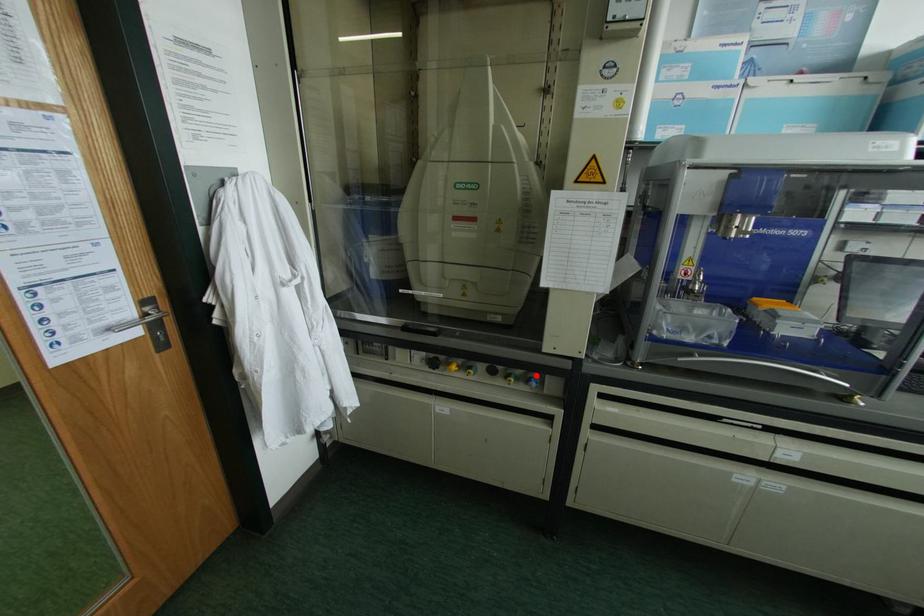
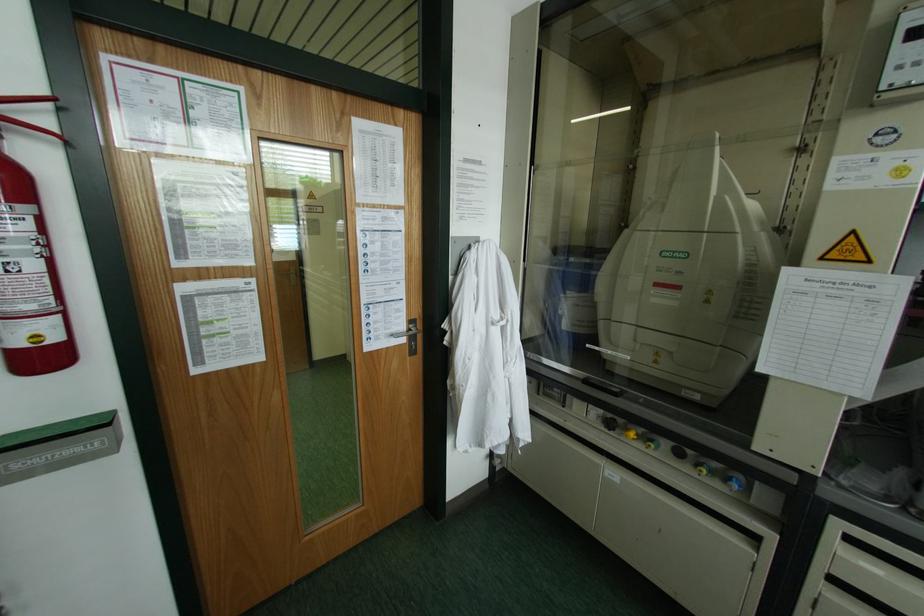
Where in the second image is the point corresponding to the highlighted location from the first image?

(740, 477)